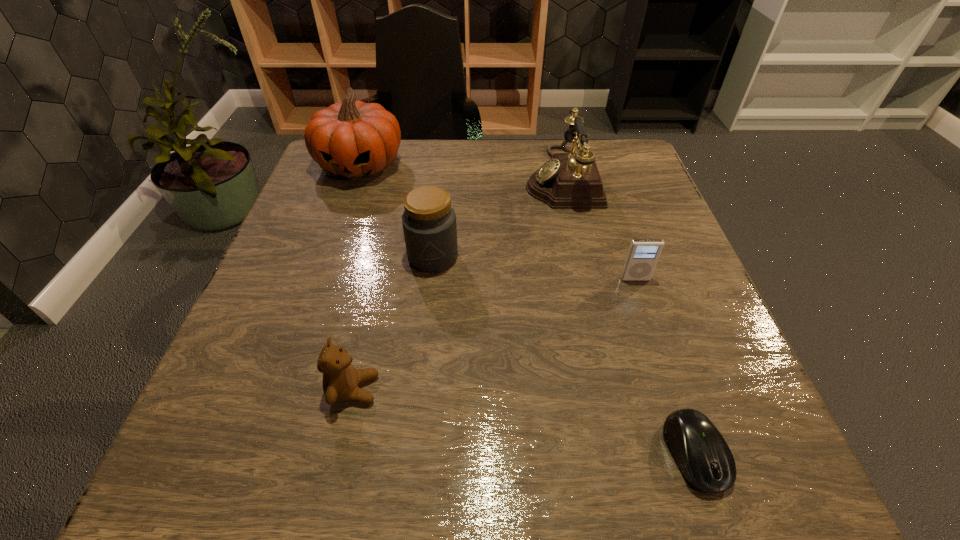
In the image, there is a desktop. At what (x,y) coordinates should I click in order to perform the action: click on vacant space at the near left corner. Please return your answer as a coordinate pair (x, y). The height and width of the screenshot is (540, 960). Looking at the image, I should click on (189, 474).

In the image, there is a desktop. Identify the location of vacant region at the far right corner. Image resolution: width=960 pixels, height=540 pixels. (636, 158).

This screenshot has height=540, width=960. In the image, there is a desktop. In order to click on vacant space at the near right corner in this screenshot , I will do `click(786, 467)`.

You are a GUI agent. You are given a task and a screenshot of the screen. Output one action in this format:
    pyautogui.click(x=<x>, y=<y>)
    Task: Click on the vacant region between the third object from left to right and the mouse
    The height and width of the screenshot is (540, 960).
    Given the screenshot: What is the action you would take?
    pyautogui.click(x=564, y=355)

Locate an element on the screen. vacant space in between the mouse and the pumpkin is located at coordinates (527, 309).

The width and height of the screenshot is (960, 540). I want to click on free space between the teddy bear and the telephone, so click(458, 284).

Locate an element on the screen. free point between the teddy bear and the fourth nearest object is located at coordinates (x=394, y=323).

Where is `vacant region between the telephone and the iPod`? The image size is (960, 540). vacant region between the telephone and the iPod is located at coordinates click(598, 228).

Find the location of a particular element. This screenshot has width=960, height=540. free area in between the teddy bear and the iPod is located at coordinates (494, 334).

This screenshot has width=960, height=540. I want to click on vacant space that's between the third farthest object and the telephone, so [x=497, y=217].